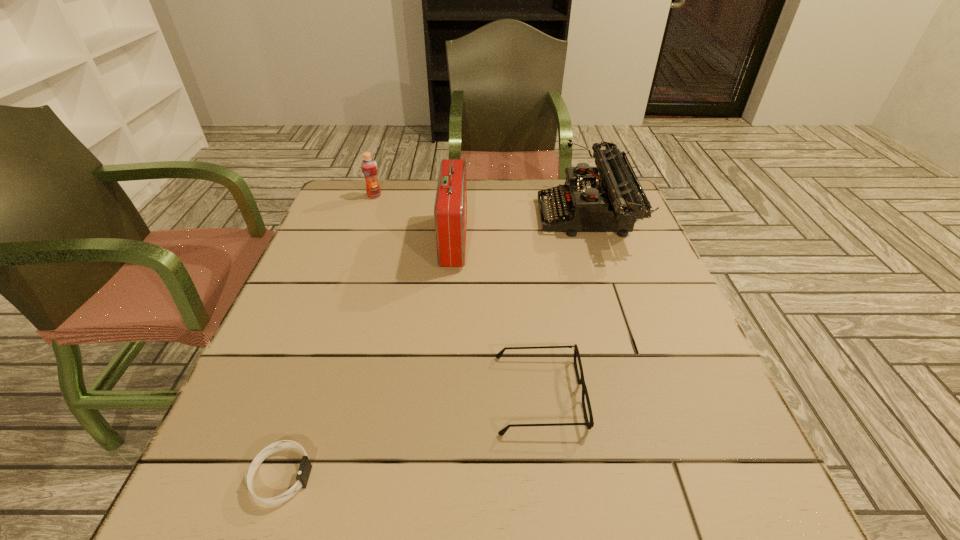
Image resolution: width=960 pixels, height=540 pixels. I want to click on the third object from left to right, so click(x=450, y=210).

At what (x,y) coordinates should I click in order to perform the action: click on the first-aid kit. Please return your answer as a coordinate pair (x, y). Image resolution: width=960 pixels, height=540 pixels. Looking at the image, I should click on (450, 210).

The height and width of the screenshot is (540, 960). What are the coordinates of `typewriter` in the screenshot? It's located at (612, 202).

Where is `the third tallest object`? This screenshot has width=960, height=540. the third tallest object is located at coordinates (369, 166).

I want to click on the fourth farthest object, so click(x=581, y=381).

Find the location of a particular element. the fourth tallest object is located at coordinates (581, 381).

In order to click on the shortest object in this screenshot , I will do point(305,467).

Find the location of `wristband`. wristband is located at coordinates (305, 467).

Where is `blank space located on the side of the tallest object with the first aid cross symbol`? The image size is (960, 540). blank space located on the side of the tallest object with the first aid cross symbol is located at coordinates click(x=559, y=241).

Where is `vacant space located 0.090m on the keyboard of the typewriter`? The image size is (960, 540). vacant space located 0.090m on the keyboard of the typewriter is located at coordinates (507, 218).